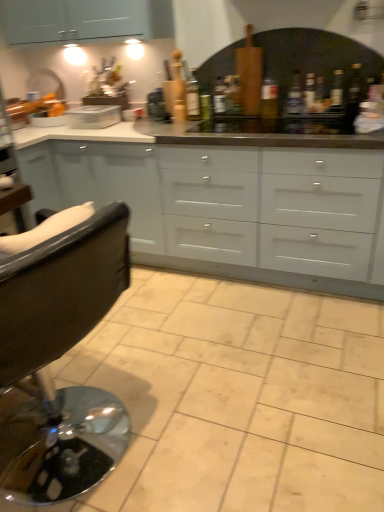
What do you see at coordinates (269, 104) in the screenshot? Image resolution: width=384 pixels, height=512 pixels. I see `matte glass bottle at center, marked as the third bottle in a left-to-right arrangement` at bounding box center [269, 104].

Find the location of a particular element. The width and height of the screenshot is (384, 512). matte glass bottle at center, the fourth bottle viewed from the right is located at coordinates (269, 104).

Looking at this image, considering the sizes of objects green glass bottle at center, arranged as the 5th bottle when viewed from the right, and translucent glass bottle at upper right, which appears as the 2th bottle when viewed from the right, in the image provided, who is shorter, green glass bottle at center, arranged as the 5th bottle when viewed from the right, or translucent glass bottle at upper right, which appears as the 2th bottle when viewed from the right,?

green glass bottle at center, arranged as the 5th bottle when viewed from the right, is shorter.

Is translucent glass bottle at upper right, which appears as the 2th bottle when viewed from the right, surrounded by green glass bottle at center, arranged as the 5th bottle when viewed from the right?

That's incorrect, translucent glass bottle at upper right, which appears as the 2th bottle when viewed from the right, is not inside green glass bottle at center, arranged as the 5th bottle when viewed from the right.

From the image's perspective, who appears lower, translucent glass bottle at upper center, placed as the fourth bottle when sorted from left to right, or beige ceramic tile at center?

beige ceramic tile at center, from the image's perspective.

Which object is thinner, translucent glass bottle at upper center, placed as the third bottle when sorted from right to left, or beige ceramic tile at center?

Thinner between the two is translucent glass bottle at upper center, placed as the third bottle when sorted from right to left.

Is translucent glass bottle at upper center, placed as the third bottle when sorted from right to left, turned away from beige ceramic tile at center?

translucent glass bottle at upper center, placed as the third bottle when sorted from right to left, does not have its back to beige ceramic tile at center.

The width and height of the screenshot is (384, 512). Find the location of `ceramic tile below the translucent glass bottle at upper center, placed as the fourth bottle when sorted from left to right (from the image's perspective)`. ceramic tile below the translucent glass bottle at upper center, placed as the fourth bottle when sorted from left to right (from the image's perspective) is located at coordinates (238, 397).

Between point (351, 104) and point (188, 109), which one is positioned behind?

The point (188, 109) is farther from the camera.

Visually, is transparent glass bottle at upper right, the 6th bottle in the left-to-right sequence, positioned to the left or to the right of green glass bottle at center, placed as the 6th bottle when sorted from right to left?

transparent glass bottle at upper right, the 6th bottle in the left-to-right sequence, is positioned on green glass bottle at center, placed as the 6th bottle when sorted from right to left,'s right side.

Between transparent glass bottle at upper right, the 6th bottle in the left-to-right sequence, and green glass bottle at center, the 1th bottle viewed from the left, which one has less height?

transparent glass bottle at upper right, the 6th bottle in the left-to-right sequence, is shorter.

Can you confirm if transparent glass bottle at upper right, which ranks as the 1th bottle in right-to-left order, is thinner than green glass bottle at center, placed as the 6th bottle when sorted from right to left?

Yes.

Considering their positions, is green glass bottle at center, the 1th bottle viewed from the left, located in front of or behind matte glass bottle at center, the fourth bottle viewed from the right?

green glass bottle at center, the 1th bottle viewed from the left, is positioned farther from the viewer than matte glass bottle at center, the fourth bottle viewed from the right.

Is green glass bottle at center, the 1th bottle viewed from the left, aimed at matte glass bottle at center, marked as the third bottle in a left-to-right arrangement?

No, green glass bottle at center, the 1th bottle viewed from the left, is not aimed at matte glass bottle at center, marked as the third bottle in a left-to-right arrangement.

From a real-world perspective, relative to matte glass bottle at center, marked as the third bottle in a left-to-right arrangement, is green glass bottle at center, the 1th bottle viewed from the left, vertically above or below?

green glass bottle at center, the 1th bottle viewed from the left, is situated higher than matte glass bottle at center, marked as the third bottle in a left-to-right arrangement, in the real world.

Is point (348, 116) behind point (115, 218)?

Yes, point (348, 116) is farther from viewer.

Who is shorter, transparent glass bottle at upper right, the 6th bottle in the left-to-right sequence, or black leather chair at left?

transparent glass bottle at upper right, the 6th bottle in the left-to-right sequence.

From the image's perspective, between transparent glass bottle at upper right, the 6th bottle in the left-to-right sequence, and black leather chair at left, which one is located above?

From the image's view, transparent glass bottle at upper right, the 6th bottle in the left-to-right sequence, is above.

Consider the image. Is transparent glass bottle at upper right, which ranks as the 1th bottle in right-to-left order, turned away from black leather chair at left?

That's not correct — transparent glass bottle at upper right, which ranks as the 1th bottle in right-to-left order, is not looking away from black leather chair at left.

Is point (336, 75) positioned before point (327, 260)?

No, (336, 75) is behind (327, 260).

Is translucent glass bottle at upper right, which is counted as the fifth bottle, starting from the left, completely or partially outside of white matte cupboard at center?

translucent glass bottle at upper right, which is counted as the fifth bottle, starting from the left, lies outside white matte cupboard at center's area.

Considering the relative positions of translucent glass bottle at upper right, which is counted as the fifth bottle, starting from the left, and white matte cupboard at center in the image provided, is translucent glass bottle at upper right, which is counted as the fifth bottle, starting from the left, in front of white matte cupboard at center?

No, translucent glass bottle at upper right, which is counted as the fifth bottle, starting from the left, is further to the viewer.

Could you tell me if green glass bottle at center, placed as the 2th bottle when sorted from left to right, is facing translucent glass bottle at upper center, placed as the third bottle when sorted from right to left?

No, green glass bottle at center, placed as the 2th bottle when sorted from left to right, is not turned towards translucent glass bottle at upper center, placed as the third bottle when sorted from right to left.

Between green glass bottle at center, arranged as the 5th bottle when viewed from the right, and translucent glass bottle at upper center, placed as the fourth bottle when sorted from left to right, which one appears on the right side from the viewer's perspective?

From the viewer's perspective, translucent glass bottle at upper center, placed as the fourth bottle when sorted from left to right, appears more on the right side.

Identify the location of the 2nd bottle to the right of the green glass bottle at center, placed as the 2th bottle when sorted from left to right, starting your count from the anchor. Image resolution: width=384 pixels, height=512 pixels. (294, 106).

From a real-world perspective, is green glass bottle at center, placed as the 2th bottle when sorted from left to right, physically located above or below translucent glass bottle at upper center, placed as the third bottle when sorted from right to left?

From a real-world perspective, green glass bottle at center, placed as the 2th bottle when sorted from left to right, is physically below translucent glass bottle at upper center, placed as the third bottle when sorted from right to left.

From a real-world perspective, which bottle is the 2nd one underneath the translucent glass bottle at upper right, which appears as the 2th bottle when viewed from the right? Please provide its 2D coordinates.

[(233, 103)]

Locate an element on the screen. the 3rd bottle behind the beige ceramic tile at center, starting your count from the anchor is located at coordinates (294, 106).

Based on their spatial positions, is translucent glass bottle at upper center, placed as the third bottle when sorted from right to left, or black leather chair at left closer to green glass bottle at center, placed as the 6th bottle when sorted from right to left?

translucent glass bottle at upper center, placed as the third bottle when sorted from right to left, is closer to green glass bottle at center, placed as the 6th bottle when sorted from right to left.

Looking at the image, which one is located further to green glass bottle at center, arranged as the 5th bottle when viewed from the right, green glass bottle at center, the 1th bottle viewed from the left, or translucent glass bottle at upper right, which appears as the 2th bottle when viewed from the right?

translucent glass bottle at upper right, which appears as the 2th bottle when viewed from the right.

Estimate the real-world distances between objects in this image. Which object is closer to green glass bottle at center, placed as the 6th bottle when sorted from right to left, translucent glass bottle at upper center, placed as the third bottle when sorted from right to left, or beige ceramic tile at center?

translucent glass bottle at upper center, placed as the third bottle when sorted from right to left, lies closer to green glass bottle at center, placed as the 6th bottle when sorted from right to left, than the other object.

Based on their spatial positions, is white matte cupboard at center or beige ceramic tile at center further from green glass bottle at center, placed as the 6th bottle when sorted from right to left?

beige ceramic tile at center.

From the image, which object appears to be nearer to matte glass bottle at center, the fourth bottle viewed from the right, translucent glass bottle at upper right, which is counted as the fifth bottle, starting from the left, or green glass bottle at center, arranged as the 5th bottle when viewed from the right?

green glass bottle at center, arranged as the 5th bottle when viewed from the right.

Based on their spatial positions, is translucent glass bottle at upper right, which appears as the 2th bottle when viewed from the right, or green glass bottle at center, the 1th bottle viewed from the left, closer to matte glass bottle at center, the fourth bottle viewed from the right?

translucent glass bottle at upper right, which appears as the 2th bottle when viewed from the right, is closer to matte glass bottle at center, the fourth bottle viewed from the right.

Looking at the image, which one is located closer to matte glass bottle at center, the fourth bottle viewed from the right, white matte cupboard at center or translucent glass bottle at upper right, which is counted as the fifth bottle, starting from the left?

The object closer to matte glass bottle at center, the fourth bottle viewed from the right, is translucent glass bottle at upper right, which is counted as the fifth bottle, starting from the left.

From the image, which object appears to be nearer to translucent glass bottle at upper right, which is counted as the fifth bottle, starting from the left, transparent glass bottle at upper right, which ranks as the 1th bottle in right-to-left order, or green glass bottle at center, placed as the 6th bottle when sorted from right to left?

Among the two, transparent glass bottle at upper right, which ranks as the 1th bottle in right-to-left order, is located nearer to translucent glass bottle at upper right, which is counted as the fifth bottle, starting from the left.

Where is `cupboard between translucent glass bottle at upper right, which appears as the 2th bottle when viewed from the right, and beige ceramic tile at center from top to bottom`? This screenshot has width=384, height=512. cupboard between translucent glass bottle at upper right, which appears as the 2th bottle when viewed from the right, and beige ceramic tile at center from top to bottom is located at coordinates (214, 211).

Locate an element on the screen. The height and width of the screenshot is (512, 384). ceramic tile between black leather chair at left and white matte cupboard at center in the front-back direction is located at coordinates (238, 397).

At what (x,y) coordinates should I click in order to perform the action: click on cupboard that lies between translucent glass bottle at upper center, placed as the third bottle when sorted from right to left, and beige ceramic tile at center from top to bottom. Please return your answer as a coordinate pair (x, y). The height and width of the screenshot is (512, 384). Looking at the image, I should click on (214, 211).

Locate an element on the screen. The image size is (384, 512). cupboard between black leather chair at left and translucent glass bottle at upper right, which appears as the 2th bottle when viewed from the right, in the front-back direction is located at coordinates (214, 211).